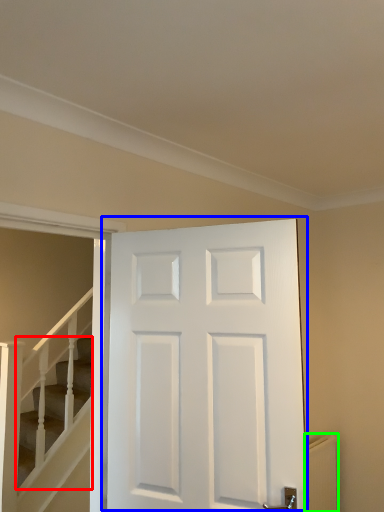
Question: Considering the real-world distances, which object is farthest from stairs (highlighted by a red box)? door (highlighted by a blue box) or radiator (highlighted by a green box)?

Choices:
 (A) door
 (B) radiator

Answer: (B)